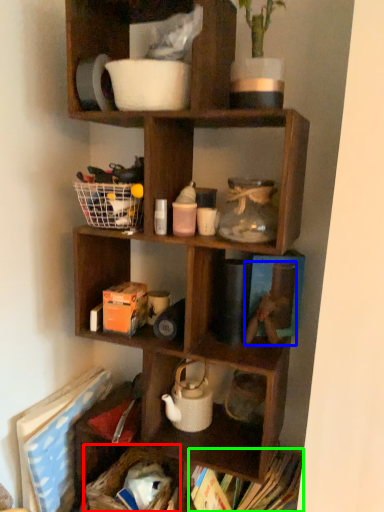
Question: Based on their relative distances, which object is nearer to basket (highlighted by a red box)? Choose from toy (highlighted by a blue box) and book (highlighted by a green box).

Choices:
 (A) toy
 (B) book

Answer: (B)